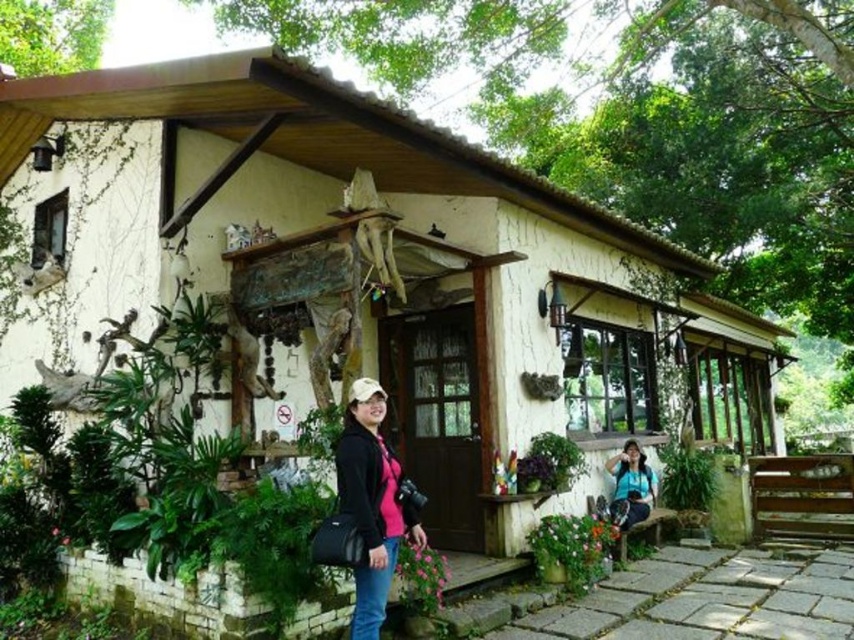
Question: Can you confirm if pink matte jacket at center is positioned below matte black camera at lower right?

Choices:
 (A) yes
 (B) no

Answer: (B)

Question: Is pink matte jacket at center to the left of matte black camera at lower right from the viewer's perspective?

Choices:
 (A) no
 (B) yes

Answer: (B)

Question: Can you confirm if pink matte jacket at center is thinner than matte black camera at lower right?

Choices:
 (A) no
 (B) yes

Answer: (B)

Question: Which point appears farthest from the camera in this image?

Choices:
 (A) (355, 429)
 (B) (619, 470)

Answer: (B)

Question: Among these objects, which one is farthest from the camera?

Choices:
 (A) pink matte jacket at center
 (B) matte black camera at lower right

Answer: (B)

Question: Which object appears closest to the camera in this image?

Choices:
 (A) matte black camera at lower right
 (B) pink matte jacket at center

Answer: (B)